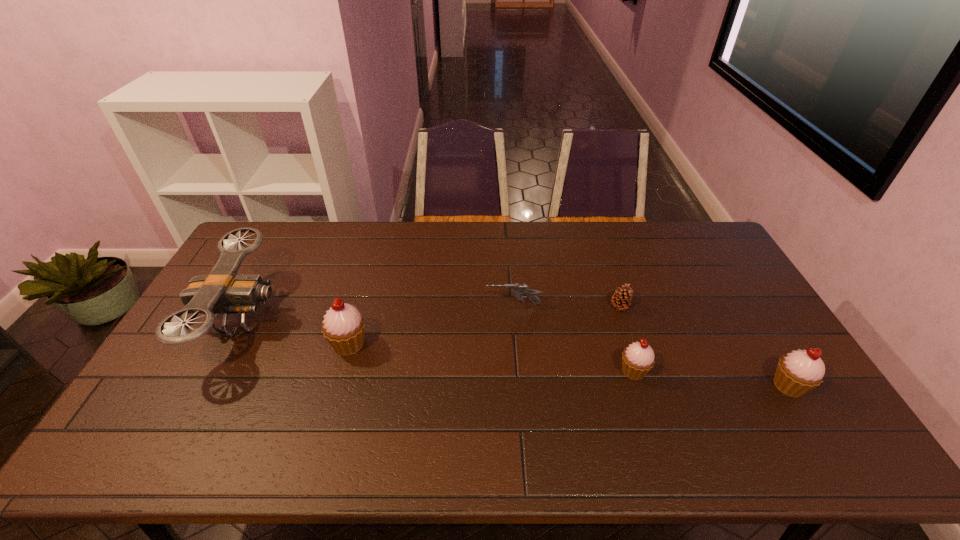
Find the location of `vacant area that lies between the gun and the pinecone`. vacant area that lies between the gun and the pinecone is located at coordinates (566, 306).

What are the coordinates of `empty space that is in between the fifth object from right to left and the shortest cupcake` in the screenshot? It's located at (492, 357).

The height and width of the screenshot is (540, 960). I want to click on free spot between the pinecone and the second object from left to right, so click(484, 325).

Image resolution: width=960 pixels, height=540 pixels. I want to click on vacant point located between the pinecone and the rightmost cupcake, so tap(704, 346).

Identify the location of empty space between the pinecone and the shortest cupcake. (627, 339).

Identify the location of object that stands as the second closest to the second tallest cupcake. The width and height of the screenshot is (960, 540). click(621, 299).

Select which object appears as the fourth closest to the fourth object from right to left. Please provide its 2D coordinates. Your answer should be formatted as a tuple, i.e. [(x, y)], where the tuple contains the x and y coordinates of a point satisfying the conditions above.

[(798, 372)]

Identify which cupcake is the nearest to the rightmost object. Please provide its 2D coordinates. Your answer should be formatted as a tuple, i.e. [(x, y)], where the tuple contains the x and y coordinates of a point satisfying the conditions above.

[(638, 358)]

The width and height of the screenshot is (960, 540). Find the location of `cupcake that stands as the second closest to the pinecone`. cupcake that stands as the second closest to the pinecone is located at coordinates (798, 372).

Locate an element on the screen. Image resolution: width=960 pixels, height=540 pixels. vacant position in the image that satisfies the following two spatial constraints: 1. on the front-facing side of the leftmost object; 2. on the back side of the rightmost cupcake is located at coordinates (205, 386).